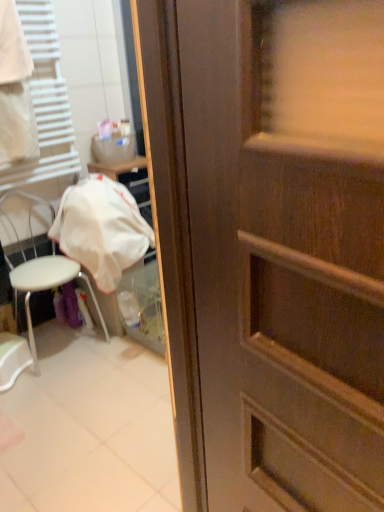
Question: Is white fabric at left not near white plastic chair at left?

Choices:
 (A) yes
 (B) no

Answer: (B)

Question: From the image's perspective, is white fabric at left beneath white plastic chair at left?

Choices:
 (A) yes
 (B) no

Answer: (B)

Question: Is white fabric at left facing towards white plastic chair at left?

Choices:
 (A) no
 (B) yes

Answer: (A)

Question: Can you confirm if white fabric at left is wider than white plastic chair at left?

Choices:
 (A) yes
 (B) no

Answer: (B)

Question: Does white fabric at left appear on the right side of white plastic chair at left?

Choices:
 (A) yes
 (B) no

Answer: (B)

Question: From a real-world perspective, is white plastic chair at left above or below white fabric at left?

Choices:
 (A) below
 (B) above

Answer: (A)

Question: In terms of width, does white plastic chair at left look wider or thinner when compared to white fabric at left?

Choices:
 (A) thin
 (B) wide

Answer: (B)

Question: Considering the positions of point (54, 287) and point (44, 64), is point (54, 287) closer or farther from the camera than point (44, 64)?

Choices:
 (A) closer
 (B) farther

Answer: (B)

Question: Is white plastic chair at left taller or shorter than white fabric at left?

Choices:
 (A) tall
 (B) short

Answer: (B)

Question: In terms of height, does white fabric at left look taller or shorter compared to white plastic chair at left?

Choices:
 (A) short
 (B) tall

Answer: (A)

Question: In the image, is white fabric at left on the left side or the right side of white plastic chair at left?

Choices:
 (A) right
 (B) left

Answer: (A)

Question: Is white fabric at left inside the boundaries of white plastic chair at left, or outside?

Choices:
 (A) inside
 (B) outside

Answer: (B)

Question: Looking at their shapes, would you say white fabric at left is wider or thinner than white plastic chair at left?

Choices:
 (A) thin
 (B) wide

Answer: (B)

Question: Is white fabric at left in front of or behind white fabric at left in the image?

Choices:
 (A) behind
 (B) front

Answer: (A)

Question: In the image, is white fabric at left on the left side or the right side of white fabric at left?

Choices:
 (A) left
 (B) right

Answer: (B)